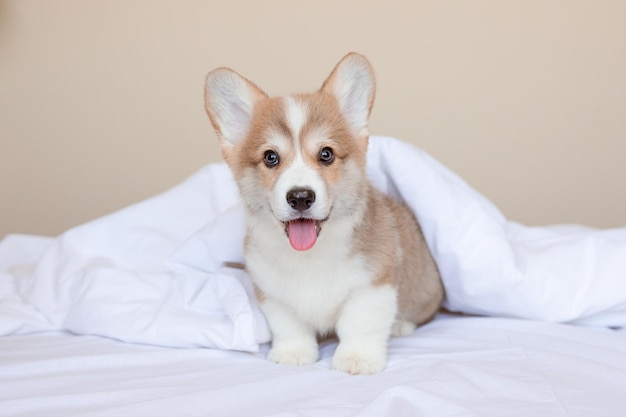
The image size is (626, 417). In order to click on wall in this screenshot , I will do `click(501, 87)`.